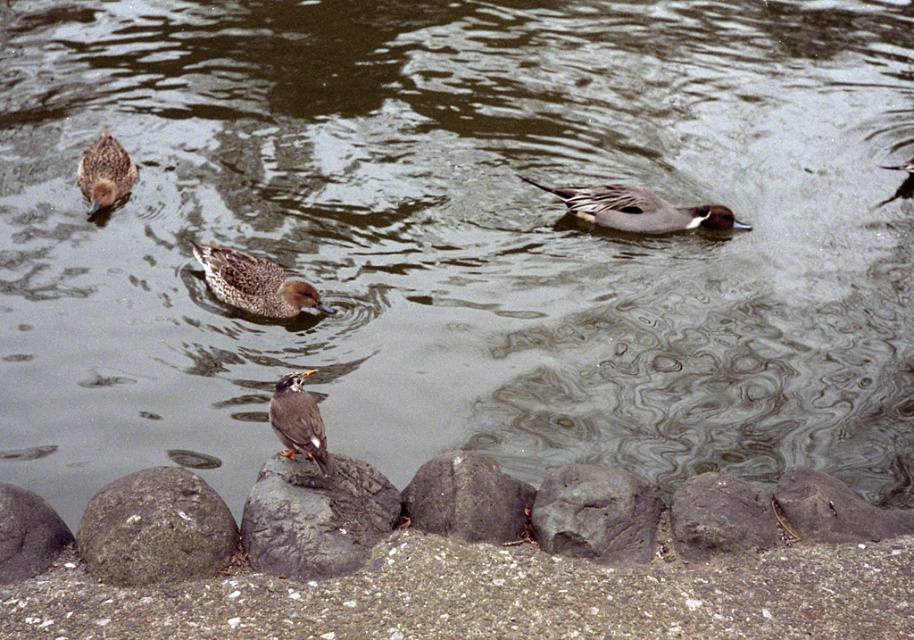
Is rough gray rock at lower left closer to the viewer compared to gray rough rock at center?

Yes, rough gray rock at lower left is in front of gray rough rock at center.

Is rough gray rock at lower left to the right of gray rough rock at center from the viewer's perspective?

In fact, rough gray rock at lower left is to the left of gray rough rock at center.

Who is more distant from viewer, [113,538] or [565,499]?

The point [565,499] is behind.

The height and width of the screenshot is (640, 914). Find the location of `rough gray rock at lower left`. rough gray rock at lower left is located at coordinates (155, 529).

Is rough gray rock at lower left above smooth gray rock at lower right?

Correct, rough gray rock at lower left is located above smooth gray rock at lower right.

Is rough gray rock at lower left below smooth gray rock at lower right?

Incorrect, rough gray rock at lower left is not positioned below smooth gray rock at lower right.

Is point (125, 483) positioned after point (856, 502)?

No, it is in front of (856, 502).

The image size is (914, 640). I want to click on rough gray rock at lower left, so click(x=155, y=529).

Based on the photo, is rough gray rock at lower left shorter than speckled feathered bird at center?

Yes.

Does point (133, 576) come closer to viewer compared to point (296, 442)?

Yes, point (133, 576) is in front of point (296, 442).

Identify the location of rough gray rock at lower left. Image resolution: width=914 pixels, height=640 pixels. (155, 529).